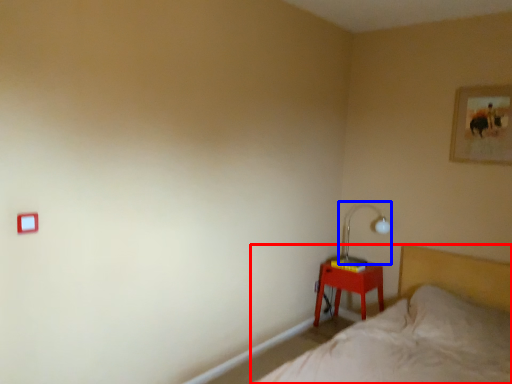
Question: Which point is closer to the camera, bed (highlighted by a red box) or table lamp (highlighted by a blue box)?

Choices:
 (A) bed
 (B) table lamp

Answer: (A)